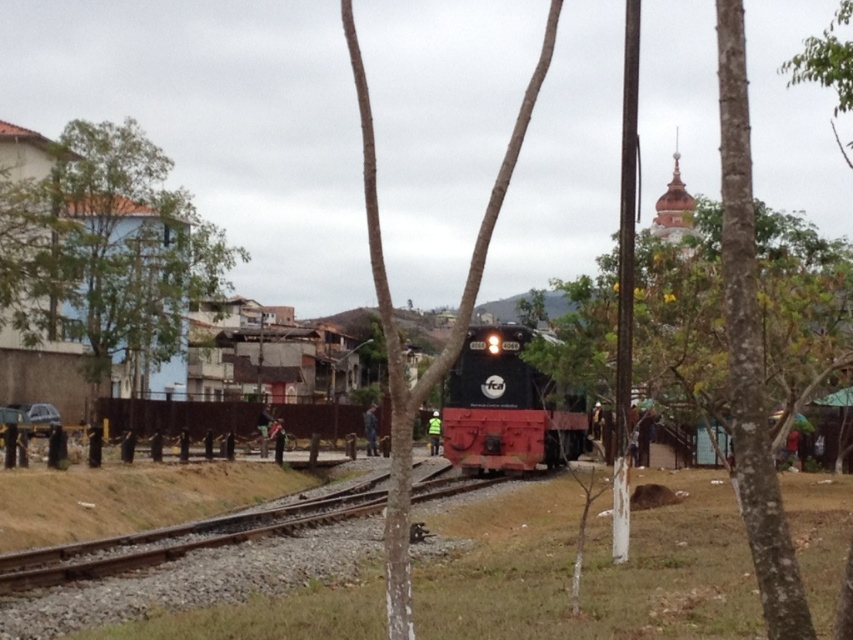
Question: Which of the following is the farthest from the observer?

Choices:
 (A) black glossy locomotive at center
 (B) green leafy tree at left
 (C) smooth bark tree at center

Answer: (B)

Question: Does green leafy tree at left have a smaller size compared to black glossy locomotive at center?

Choices:
 (A) no
 (B) yes

Answer: (A)

Question: Which point is farther to the camera?

Choices:
 (A) (456, 380)
 (B) (213, 248)

Answer: (B)

Question: Which of the following is the farthest from the observer?

Choices:
 (A) black glossy locomotive at center
 (B) green leafy tree at left
 (C) smooth bark tree at center

Answer: (B)

Question: Can you confirm if green leafy tree at left is positioned above black glossy locomotive at center?

Choices:
 (A) yes
 (B) no

Answer: (A)

Question: Where is smooth bark tree at center located in relation to black glossy locomotive at center in the image?

Choices:
 (A) above
 (B) below

Answer: (A)